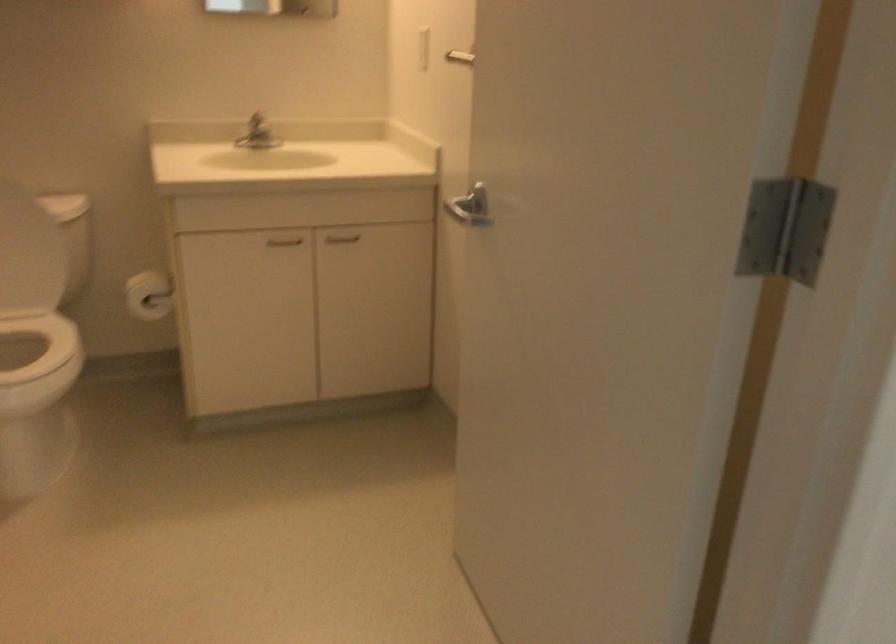
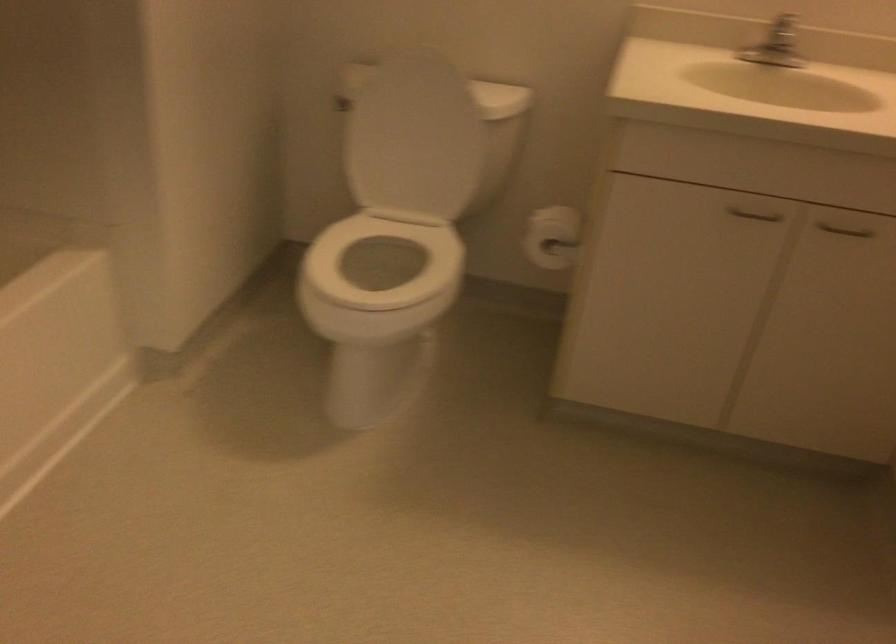
Where in the second image is the point corresponding to point (283, 239) from the first image?

(754, 214)